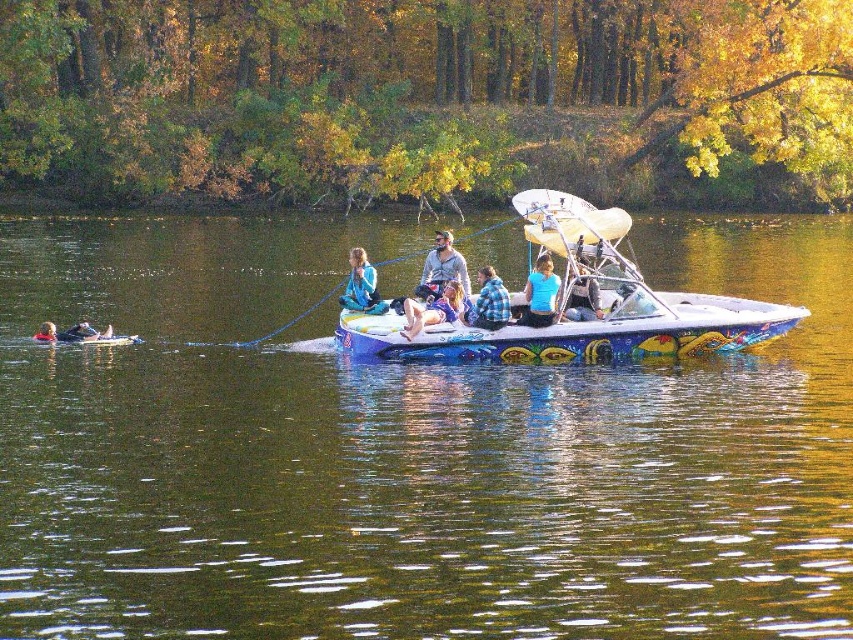
You are organizing a lakeside event and need to ensure that the painted wood boat at center can accommodate a blue plaid shirt at center. Given their sizes, will the boat be able to hold the shirt comfortably?

The painted wood boat at center has a larger width than the blue plaid shirt at center, so it should be able to accommodate the shirt comfortably.